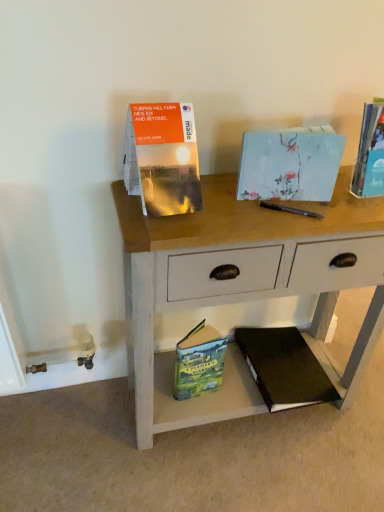
Question: Relative to wooden desk at center, is hardcover book at upper right, the 5th paperback book when ordered from bottom to top, in front or behind?

Choices:
 (A) front
 (B) behind

Answer: (B)

Question: Based on their sizes in the image, would you say hardcover book at upper right, positioned as the first paperback book in top-to-bottom order, is bigger or smaller than wooden desk at center?

Choices:
 (A) big
 (B) small

Answer: (B)

Question: Which object is the closest to the black hardcover book at lower right, arranged as the 1th paperback book when ordered from the bottom?

Choices:
 (A) hardcover book at upper right, the 5th paperback book when ordered from bottom to top
 (B) wooden desk at center
 (C) light blue paper at center, the second paperback book from the top
 (D) matte orange map at upper left, the 3th paperback book positioned from the top
 (E) green matte paperback book at lower center, placed as the second paperback book when sorted from bottom to top

Answer: (E)

Question: Which is nearer to the black hardcover book at lower right, arranged as the 1th paperback book when ordered from the bottom?

Choices:
 (A) wooden desk at center
 (B) light blue paper at center, the second paperback book from the top
 (C) hardcover book at upper right, positioned as the first paperback book in top-to-bottom order
 (D) green matte paperback book at lower center, placed as the second paperback book when sorted from bottom to top
 (E) matte orange map at upper left, the 3th paperback book positioned from the top

Answer: (D)